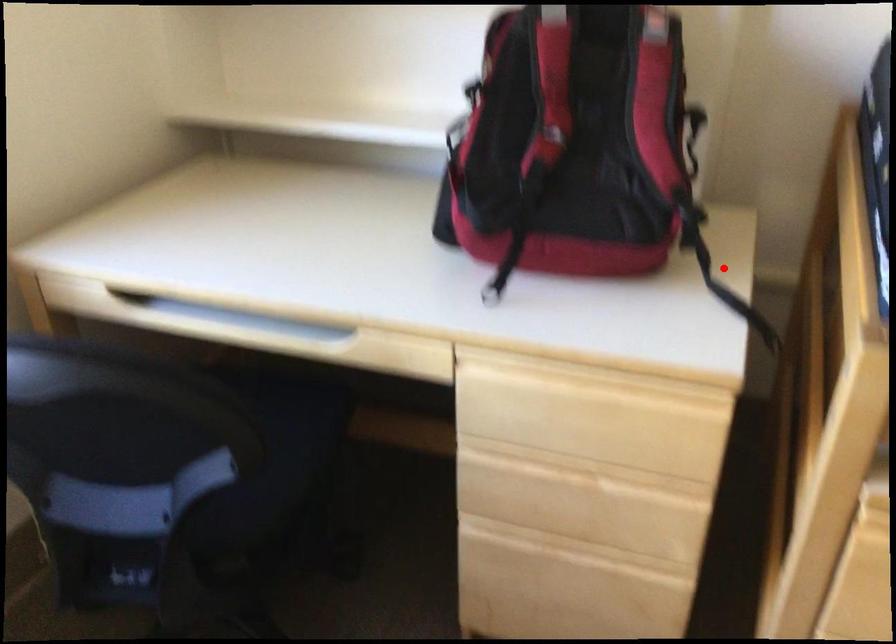
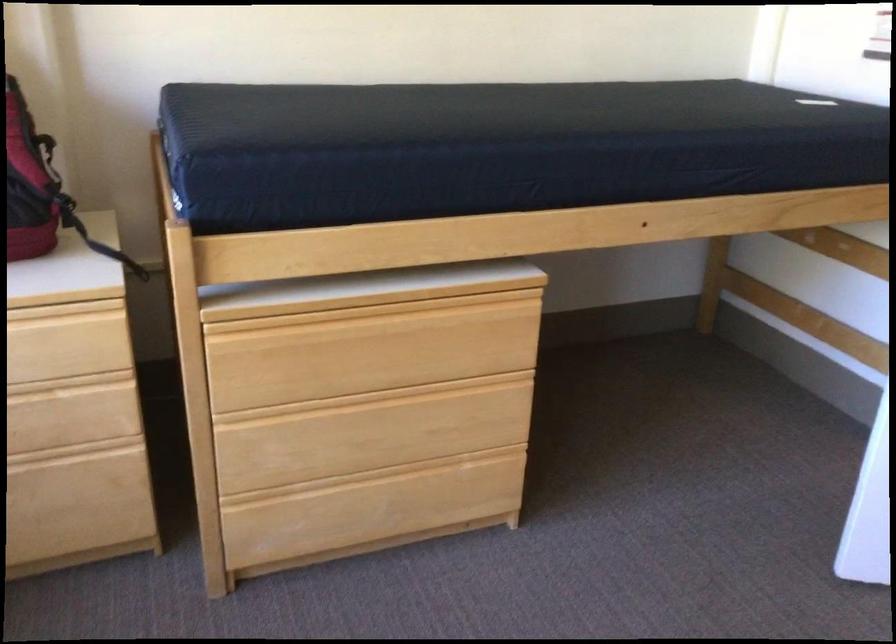
Question: I am providing you with two images of the same scene from different viewpoints. Given a red point in image1, look at the same physical point in image2. Is it:

Choices:
 (A) Closer to the viewpoint
 (B) Farther from the viewpoint

Answer: (B)